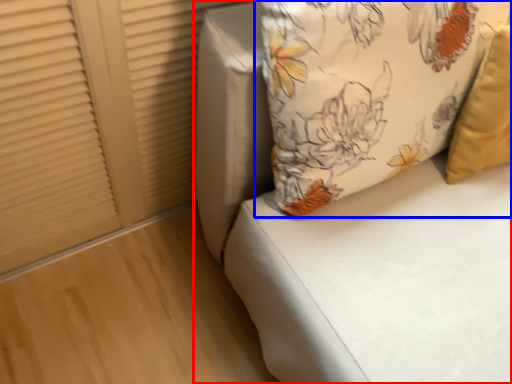
Question: Which object is further to the camera taking this photo, furniture (highlighted by a red box) or pillow (highlighted by a blue box)?

Choices:
 (A) furniture
 (B) pillow

Answer: (B)